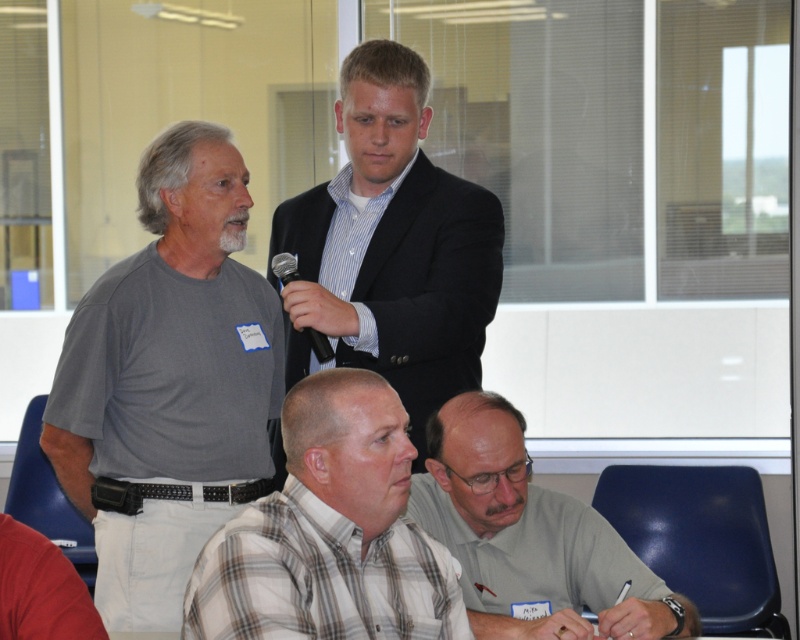
Describe the element at coordinates (392, 246) in the screenshot. I see `matte black suit at center` at that location.

Is the position of matte black suit at center less distant than that of plaid cotton shirt at lower center?

That is False.

Locate an element on the screen. matte black suit at center is located at coordinates (392, 246).

Consider the image. Is matte black suit at center closer to the viewer compared to gray fabric shirt at lower center?

No, matte black suit at center is further to the viewer.

Between point (384, 44) and point (688, 624), which one is positioned in front?

Point (688, 624) is more forward.

This screenshot has width=800, height=640. I want to click on matte black suit at center, so click(392, 246).

Does point (404, 436) come behind point (288, 269)?

No, it is in front of (288, 269).

Does plaid cotton shirt at lower center appear on the left side of black plastic microphone at center?

In fact, plaid cotton shirt at lower center is to the right of black plastic microphone at center.

The height and width of the screenshot is (640, 800). What do you see at coordinates (329, 532) in the screenshot?
I see `plaid cotton shirt at lower center` at bounding box center [329, 532].

This screenshot has width=800, height=640. What are the coordinates of `plaid cotton shirt at lower center` in the screenshot? It's located at (329, 532).